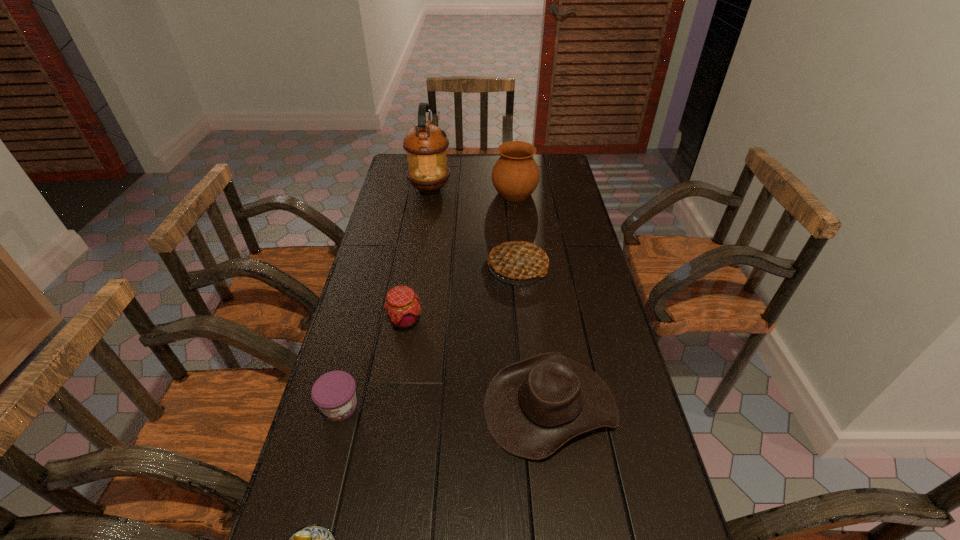
In order to click on the tallest object in this screenshot , I will do `click(425, 144)`.

This screenshot has height=540, width=960. What are the coordinates of `the second tallest object` in the screenshot? It's located at (515, 175).

Where is `pie`? pie is located at coordinates (519, 260).

This screenshot has width=960, height=540. I want to click on the fifth shortest object, so click(519, 260).

Locate an element on the screen. the taller jam is located at coordinates (402, 307).

Locate an element on the screen. the farther jam is located at coordinates (402, 307).

This screenshot has height=540, width=960. What are the coordinates of `cowboy hat` in the screenshot? It's located at (532, 407).

Find the location of a particular element. The width and height of the screenshot is (960, 540). the nearer jam is located at coordinates (334, 393).

Where is `the shorter jam`? The height and width of the screenshot is (540, 960). the shorter jam is located at coordinates (334, 393).

I want to click on free space located on the right of the oil lamp, so click(514, 189).